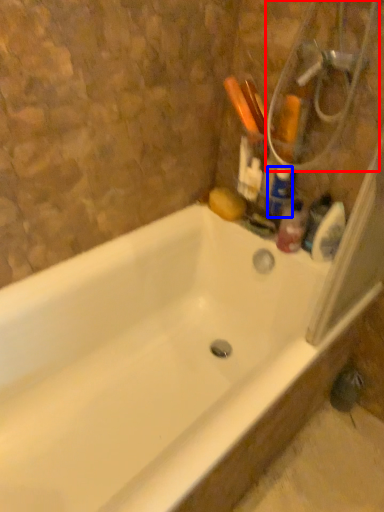
Question: Which of the following is the closest to the observer, shower (highlighted by a red box) or cleaning product (highlighted by a blue box)?

Choices:
 (A) shower
 (B) cleaning product

Answer: (A)